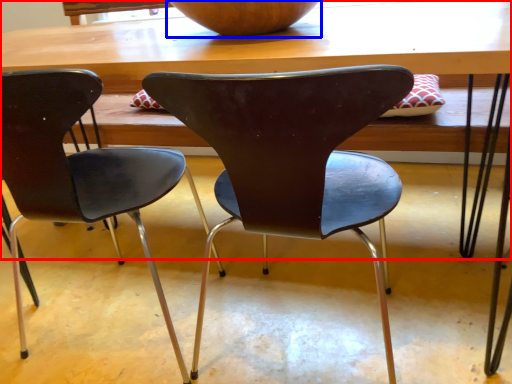
Question: Which of the following is the closest to the observer, table (highlighted by a red box) or bowl (highlighted by a blue box)?

Choices:
 (A) table
 (B) bowl

Answer: (A)